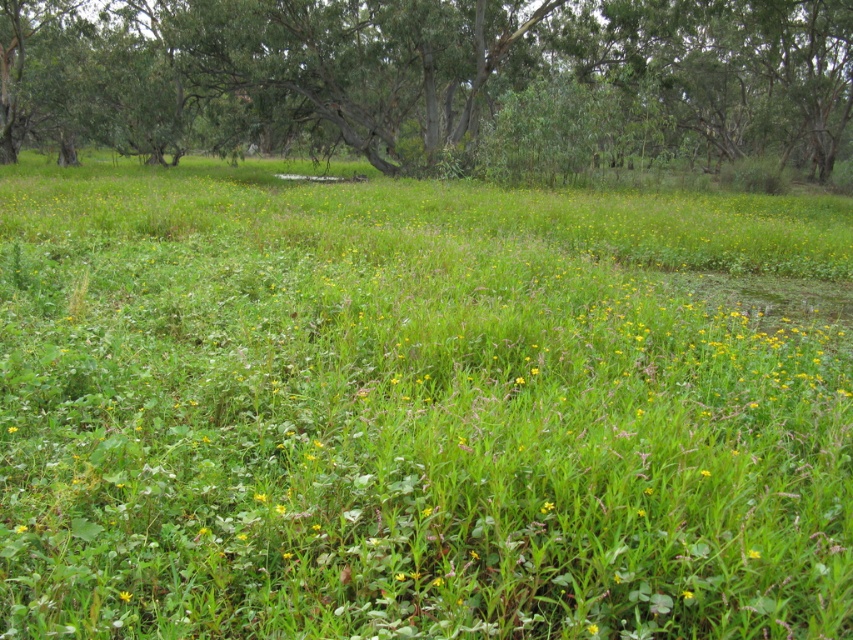
Looking at this image, you are standing in the meadow and notice the green leafy tree at center. Based on its position coordinates, can you determine if it is closer to the left or right edge of the meadow?

The green leafy tree at center is located at point 0.120 on the x axis, which is closer to the left edge of the meadow since the center would be at 0.5. Therefore, it is closer to the left edge.

You are a gardener standing in the meadow and want to water both the green leafy tree at center and the yellow matte flower at center. Which one should you water first if you want to start with the one closer to you?

You should water the green leafy tree at center first because it is closer to you than the yellow matte flower at center.